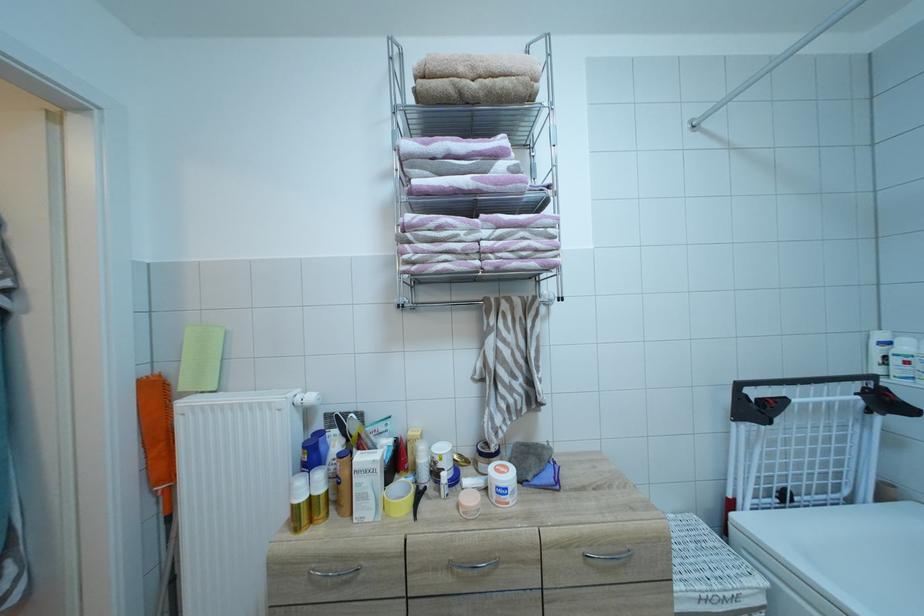
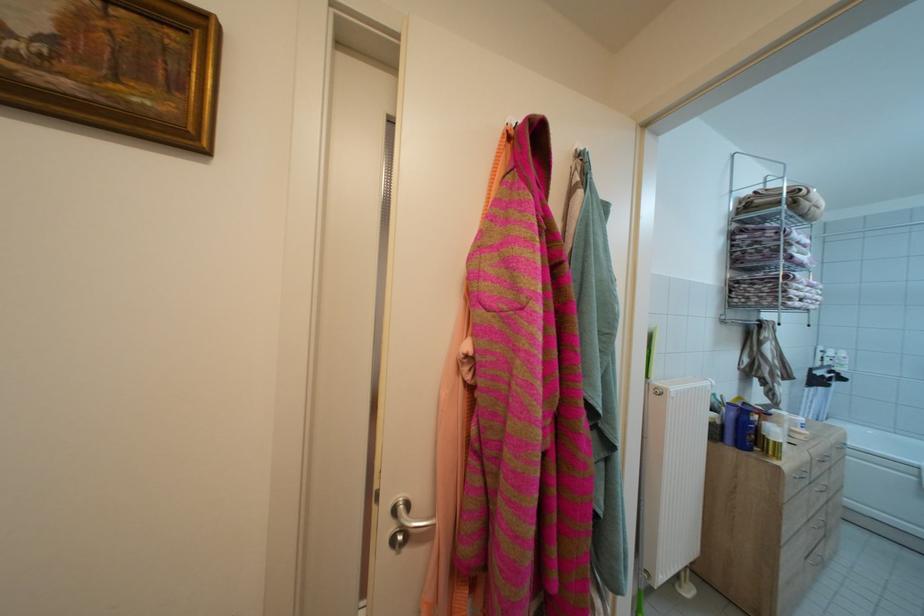
Question: What movement of the cameraman would produce the second image?

Choices:
 (A) Left
 (B) Right
 (C) Forward
 (D) Backward

Answer: (A)